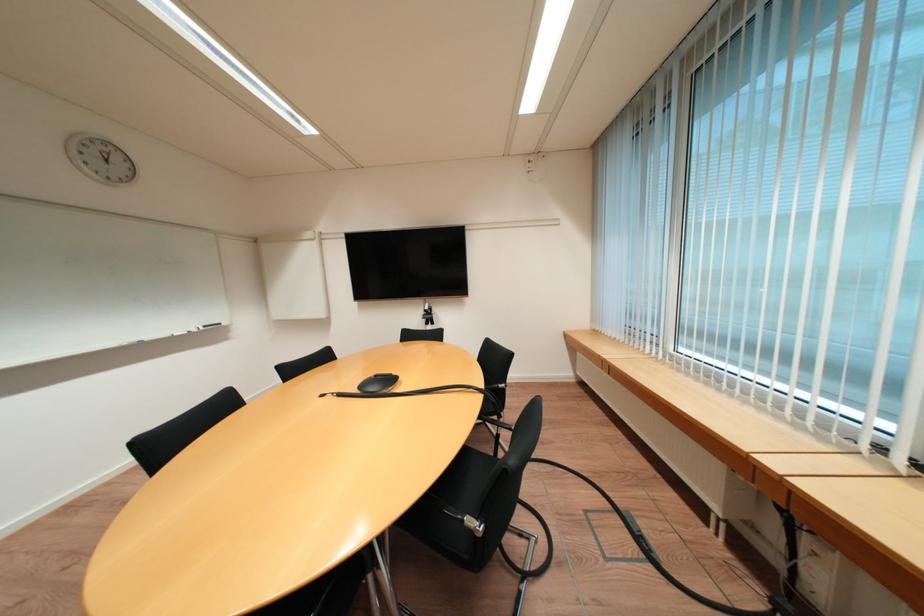
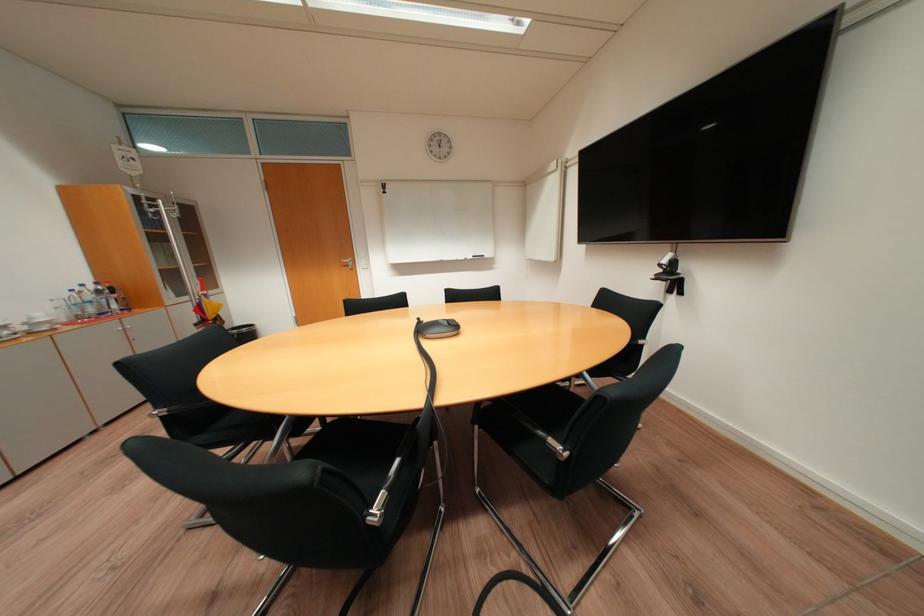
The point at (435, 310) is marked in the first image. Where is the corresponding point in the second image?

(673, 262)